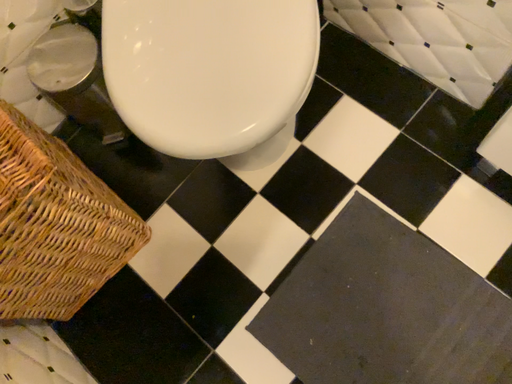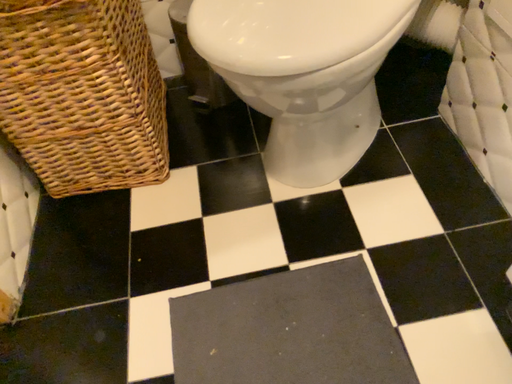
Question: Which way did the camera rotate in the video?

Choices:
 (A) rotated left
 (B) rotated right

Answer: (A)